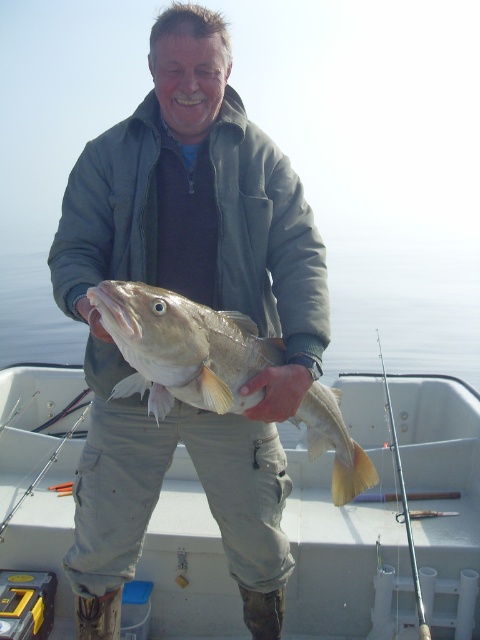
Does gray woolen jacket at center come behind silver metallic fishing pole at right?

No, it is not.

How distant is gray woolen jacket at center from silver metallic fishing pole at right?

1.05 meters

Who is more distant from viewer, (109, 470) or (412, 557)?

The point (109, 470) is behind.

Identify the location of gray woolen jacket at center. (194, 300).

Is white matte fish at center closer to the viewer compared to shiny silver fish at center?

No, white matte fish at center is behind shiny silver fish at center.

Between point (373, 488) and point (105, 284), which one is positioned in front?

Point (105, 284) is more forward.

Locate an element on the screen. Image resolution: width=480 pixels, height=640 pixels. white matte fish at center is located at coordinates (342, 557).

Identify the location of gray woolen jacket at center. The image size is (480, 640). (194, 300).